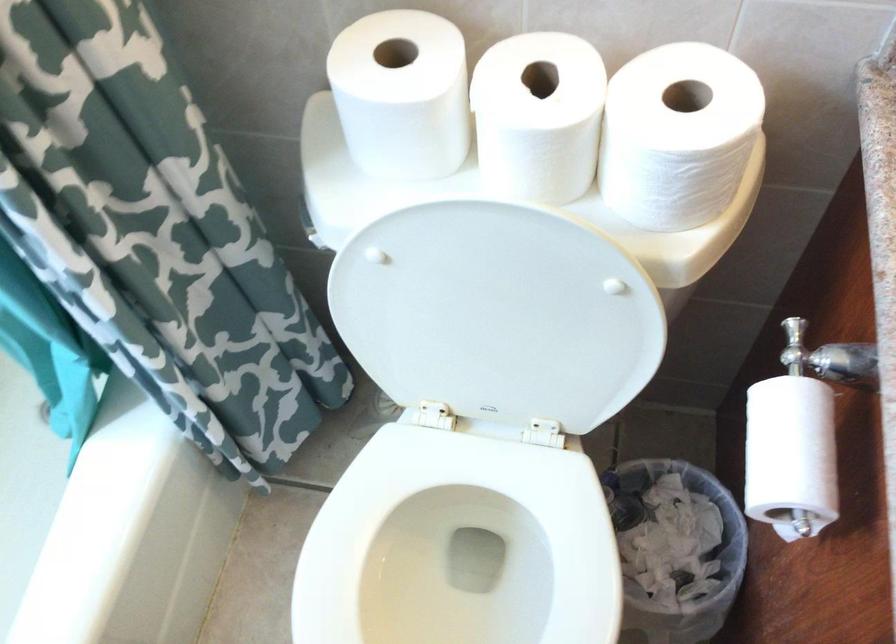
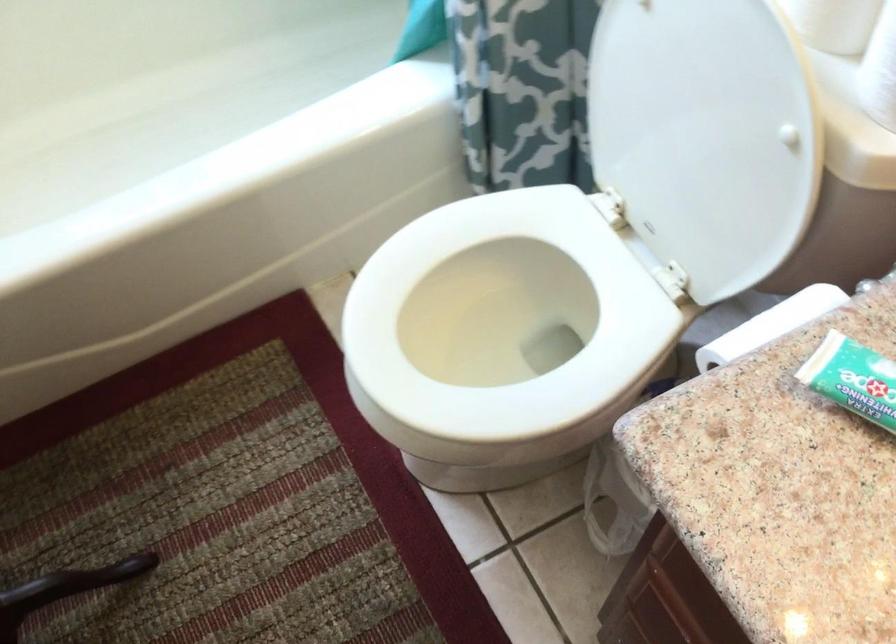
In the second image, find the point that corresponds to the point at 489,279 in the first image.

(708, 71)